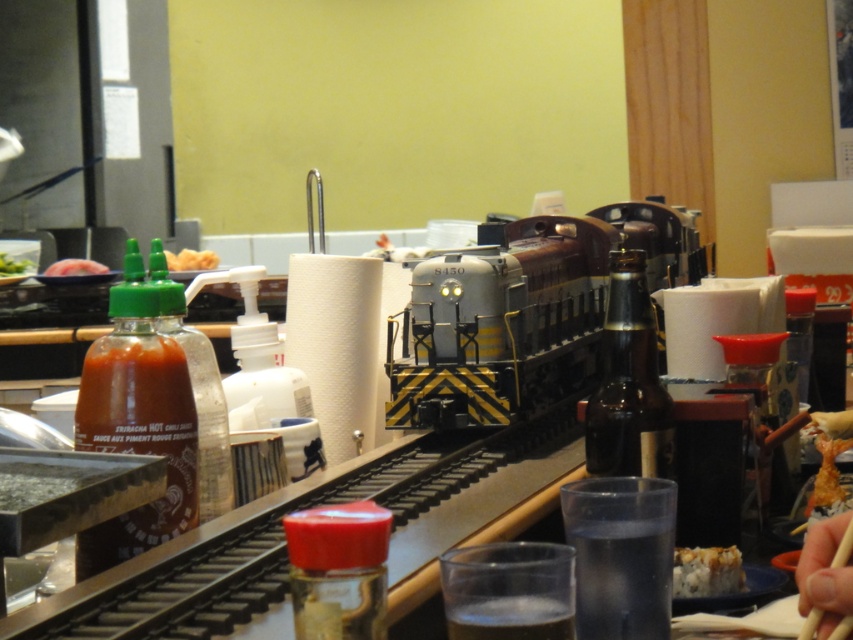
Can you confirm if golden crispy shrimp at lower right is positioned to the left of skinny chopsticks at center?

In fact, golden crispy shrimp at lower right is to the right of skinny chopsticks at center.

Which is more to the right, golden crispy shrimp at lower right or skinny chopsticks at center?

golden crispy shrimp at lower right

Is point (844, 490) positioned in front of point (844, 534)?

No.

Where is `golden crispy shrimp at lower right`? golden crispy shrimp at lower right is located at coordinates (827, 480).

Does golden crispy shrimp at lower right lie in front of matte black meat at left?

Yes.

Is golden crispy shrimp at lower right smaller than matte black meat at left?

Indeed, golden crispy shrimp at lower right has a smaller size compared to matte black meat at left.

Describe the element at coordinates (827, 480) in the screenshot. Image resolution: width=853 pixels, height=640 pixels. I see `golden crispy shrimp at lower right` at that location.

The height and width of the screenshot is (640, 853). I want to click on golden crispy shrimp at lower right, so coord(827,480).

Who is taller, yellow crumbly snack at center or green leafy vegetable at center?

yellow crumbly snack at center

The width and height of the screenshot is (853, 640). In order to click on yellow crumbly snack at center in this screenshot , I will do `click(190, 259)`.

Identify the location of yellow crumbly snack at center. (190, 259).